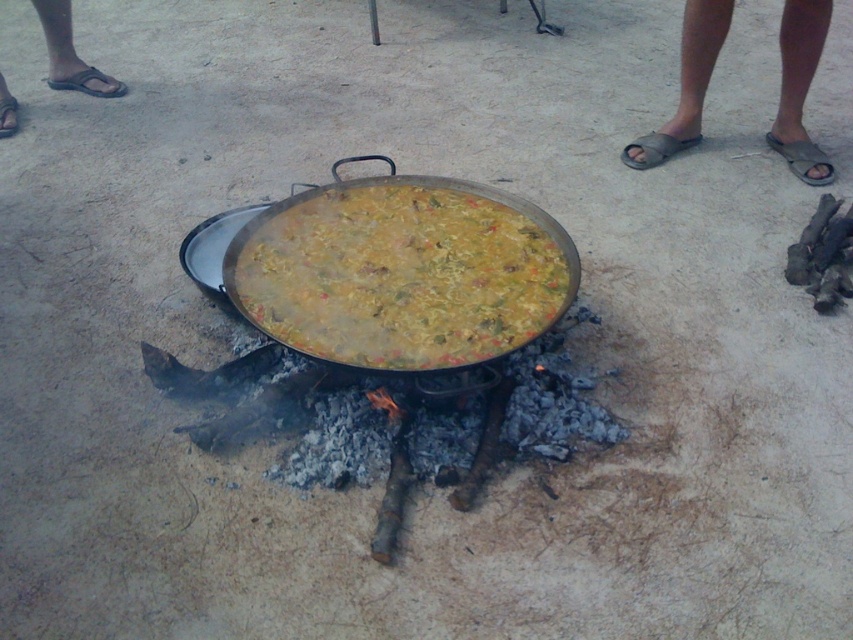
Is yellowish matte paella at center to the right of gray fabric sandals at right from the viewer's perspective?

Incorrect, yellowish matte paella at center is not on the right side of gray fabric sandals at right.

Between yellowish matte paella at center and gray fabric sandals at right, which one appears on the left side from the viewer's perspective?

From the viewer's perspective, yellowish matte paella at center appears more on the left side.

Describe the element at coordinates (401, 275) in the screenshot. This screenshot has width=853, height=640. I see `yellowish matte paella at center` at that location.

The height and width of the screenshot is (640, 853). What are the coordinates of `yellowish matte paella at center` in the screenshot? It's located at (401, 275).